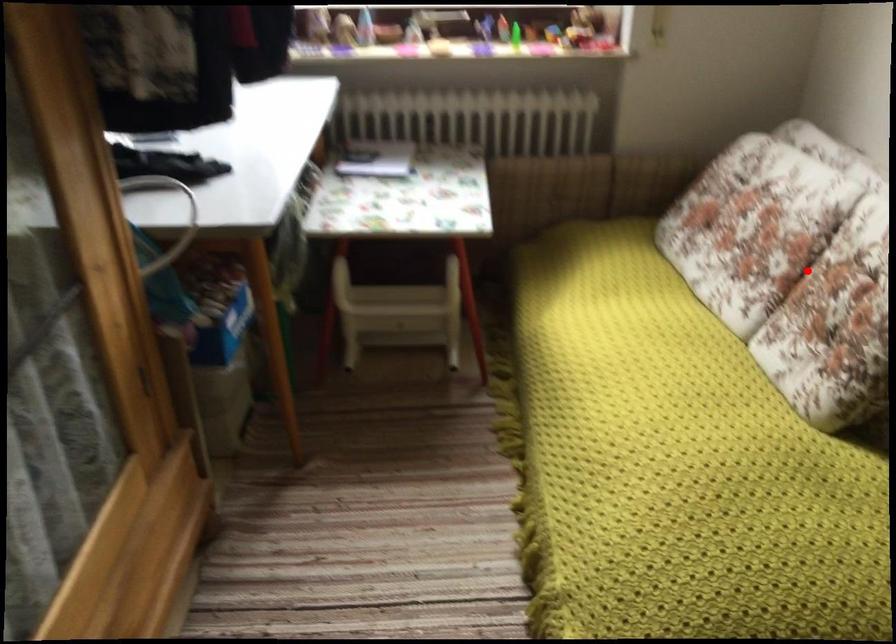
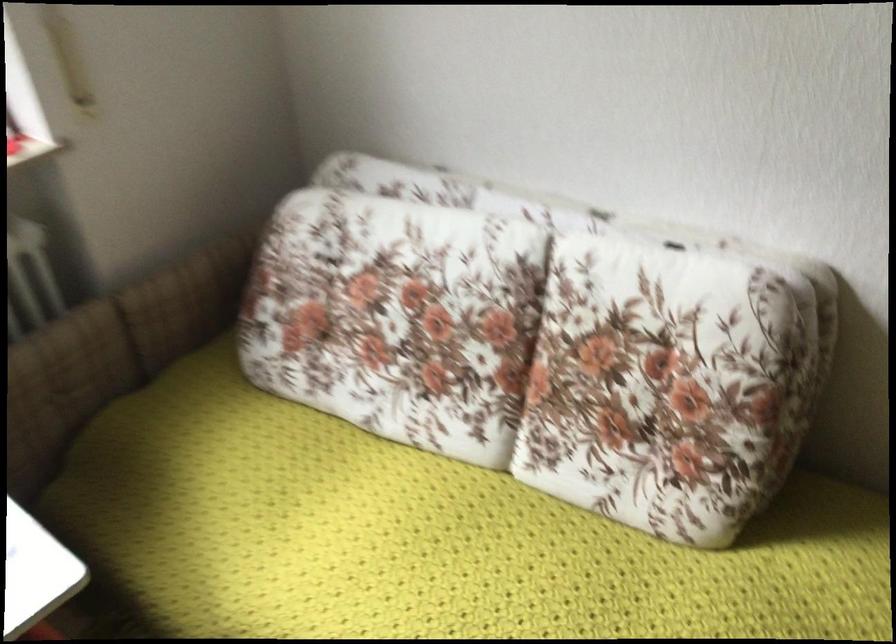
Locate, in the second image, the point that corresponds to the highlighted location in the first image.

(530, 354)